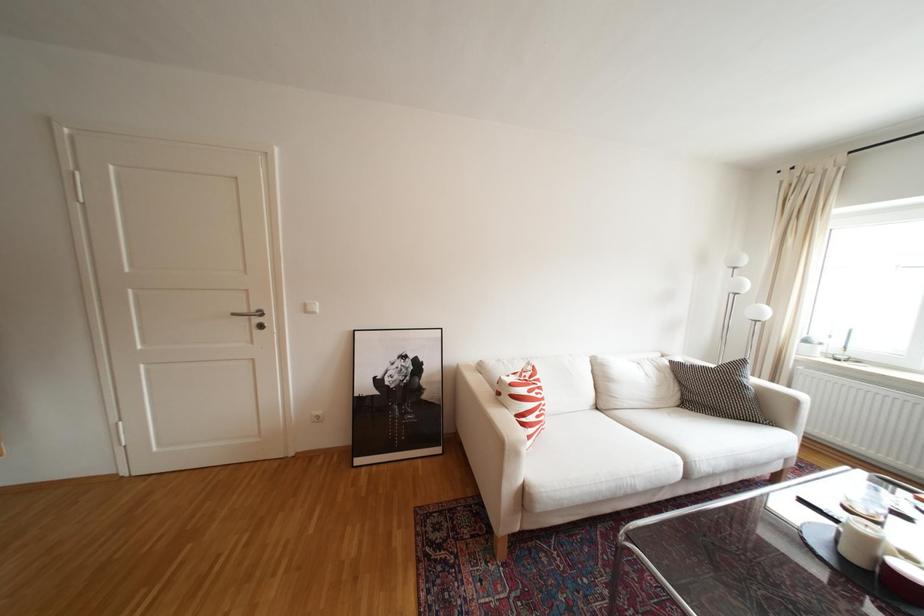
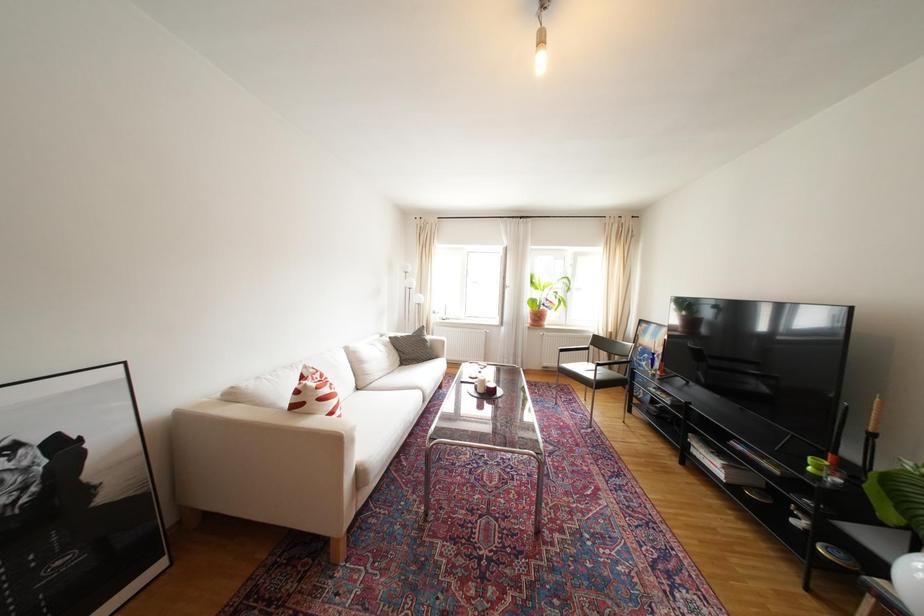
Question: How did the camera likely rotate?

Choices:
 (A) Left
 (B) Right
 (C) Up
 (D) Down

Answer: (B)